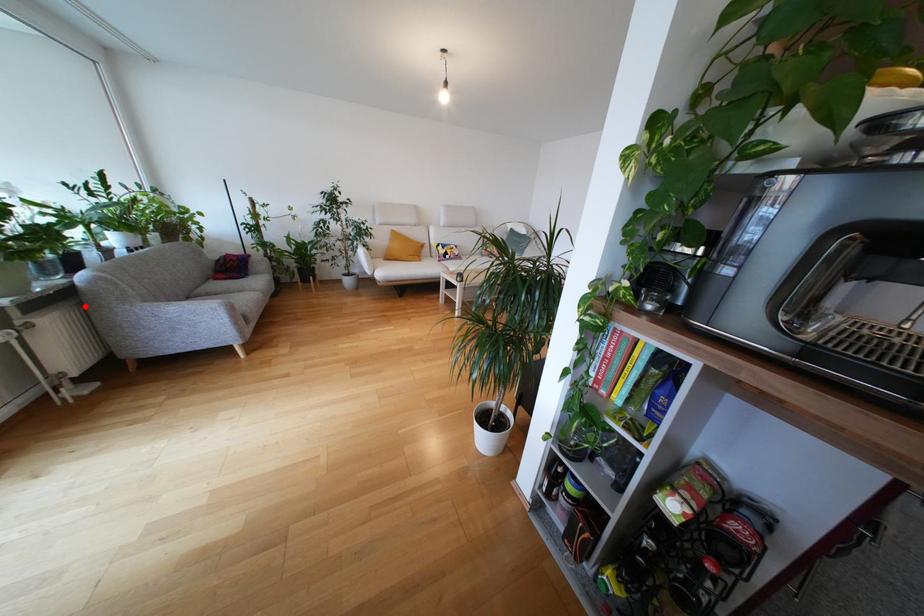
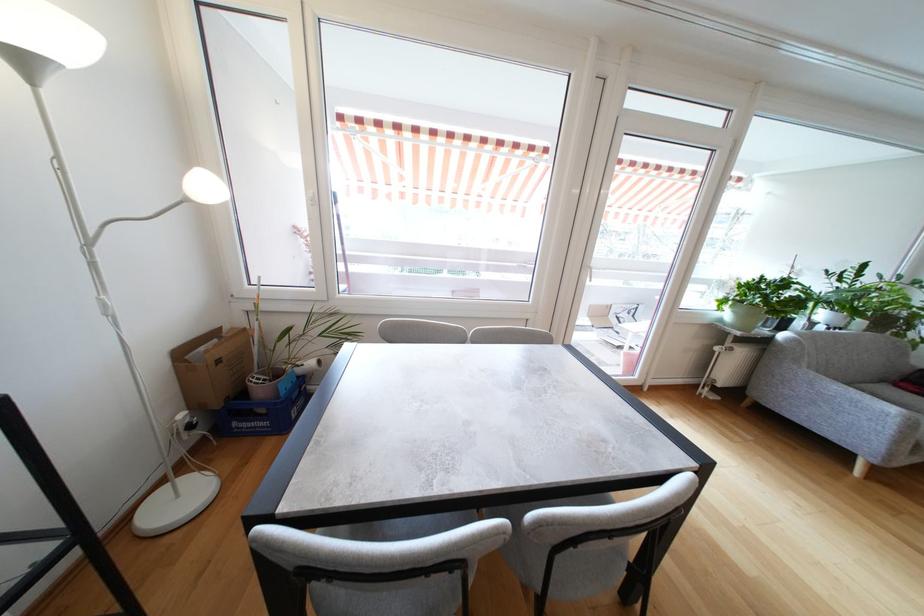
Question: I am providing you with two images of the same scene from different viewpoints. A red point is shown in image1. For the corresponding object point in image2, is it positioned nearer or farther from the camera?

Choices:
 (A) Nearer
 (B) Farther

Answer: (A)